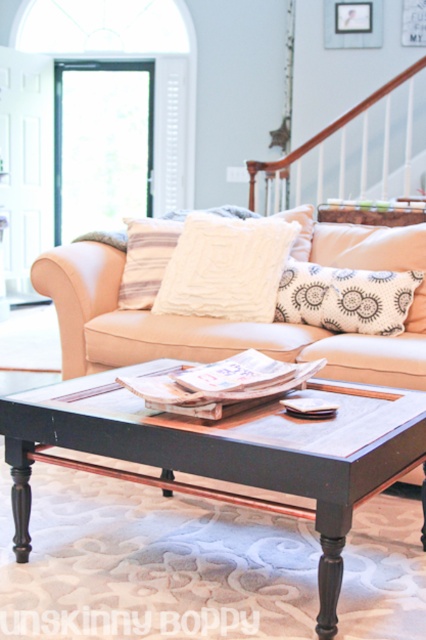
Based on the photo, you are trying to decide whether to place a new large decorative item on the beige fabric couch at center or the white textured pillow at center. Based on their sizes, which one can accommodate the item better?

The beige fabric couch at center is bigger than the white textured pillow at center, so it can accommodate the large decorative item better.